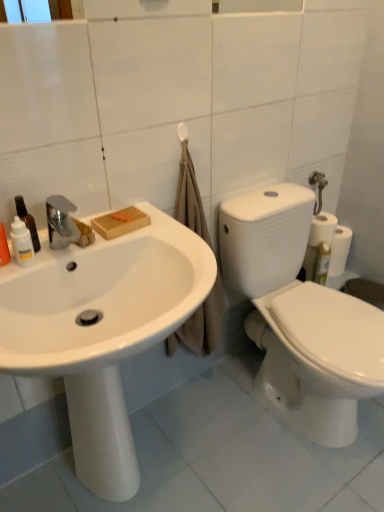
You are a GUI agent. You are given a task and a screenshot of the screen. Output one action in this format:
    pyautogui.click(x=<x>, y=<y>)
    Task: Click on the vacant region to the right of translucent plastic bottle at left, which ranks as the second cleaning product in left-to-right order
    The height and width of the screenshot is (512, 384).
    Given the screenshot: What is the action you would take?
    pyautogui.click(x=77, y=248)